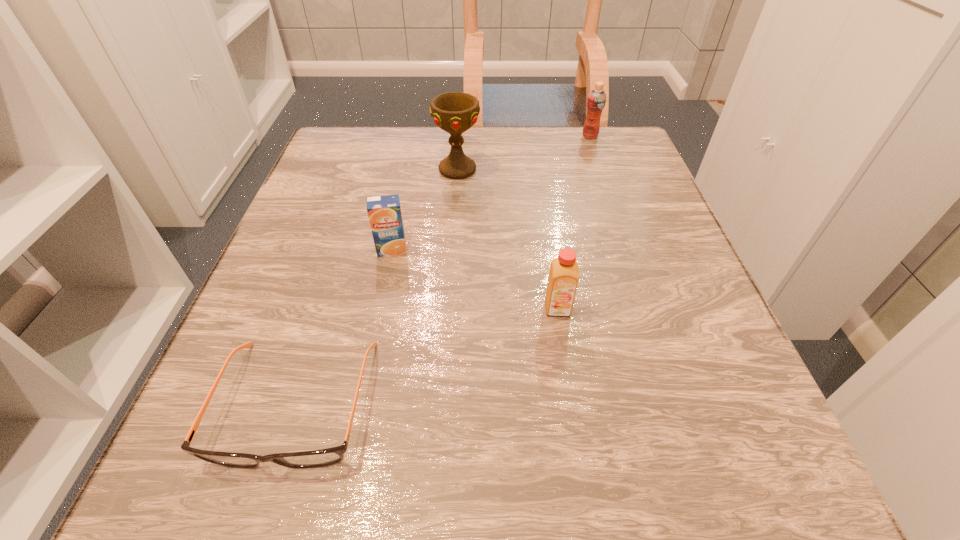
You are a GUI agent. You are given a task and a screenshot of the screen. Output one action in this format:
    pyautogui.click(x=<x>, y=<y>)
    Task: Click on the free space that satisfies the following two spatial constraints: 1. on the back side of the second farthest orange_juice; 2. on the right side of the third object from left to right
    
    Given the screenshot: What is the action you would take?
    pyautogui.click(x=408, y=170)

Where is `vacant area in the image that satisfies the following two spatial constraints: 1. on the back side of the farthest orange_juice; 2. on the right side of the leftmost orange_juice`? The image size is (960, 540). vacant area in the image that satisfies the following two spatial constraints: 1. on the back side of the farthest orange_juice; 2. on the right side of the leftmost orange_juice is located at coordinates pyautogui.click(x=416, y=136).

Where is `free space that satisfies the following two spatial constraints: 1. on the back side of the farthest object; 2. on the right side of the second farthest object`? Image resolution: width=960 pixels, height=540 pixels. free space that satisfies the following two spatial constraints: 1. on the back side of the farthest object; 2. on the right side of the second farthest object is located at coordinates [460, 136].